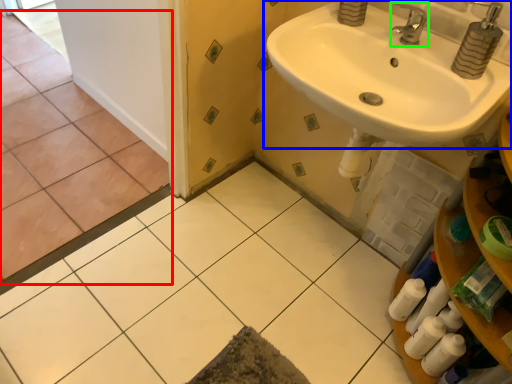
Question: Which object is positioned farthest from ceramic tile (highlighted by a red box)? Select from sink (highlighted by a blue box) and tap (highlighted by a green box).

Choices:
 (A) sink
 (B) tap

Answer: (B)